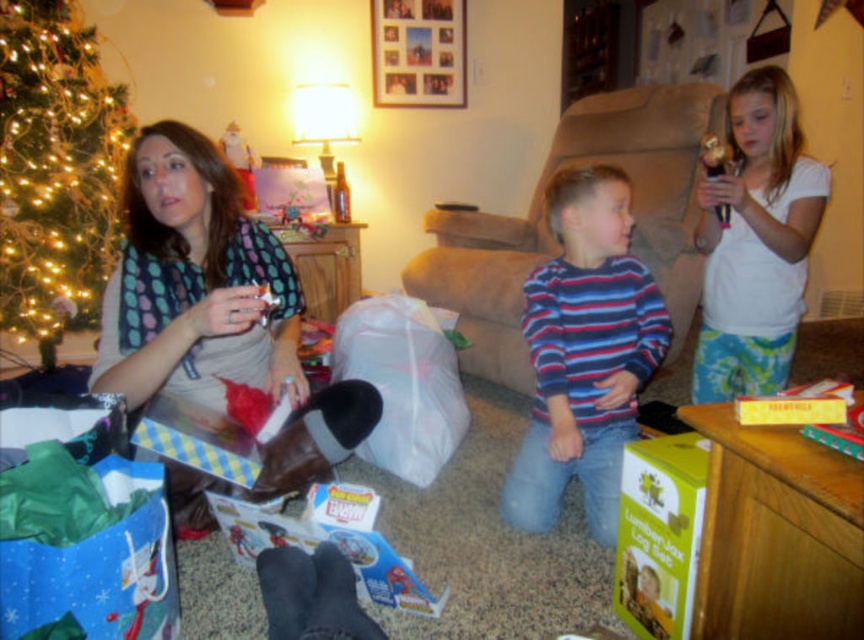
You are a photographer setting up for a family photo. You notice the polka dot fabric shirt at left and the green matte christmas tree at left in the scene. Which object is positioned more to the right from your perspective?

The polka dot fabric shirt at left is to the right of the green matte christmas tree at left, so the polka dot fabric shirt at left is positioned more to the right.

You are a parent trying to hand a gift to your child. You are holding a gift box that is 45 centimeters wide. There is a striped cotton shirt at center and a white cotton shirt at upper right. Can you place the gift between them without moving the shirts?

The distance between the striped cotton shirt at center and white cotton shirt at upper right is 46.56 centimeters. Since the gift box is 45 centimeters wide, it can fit between them as the space is slightly larger than the gift.

You are a parent trying to find a place to hang a 1.2 meter tall decoration. You see the polka dot fabric shirt at left and the green matte christmas tree at left. Which object is shorter and can accommodate the decoration?

The polka dot fabric shirt at left is shorter than the green matte christmas tree at left, so the decoration can be placed on the green matte christmas tree at left since it is taller and can support the height.